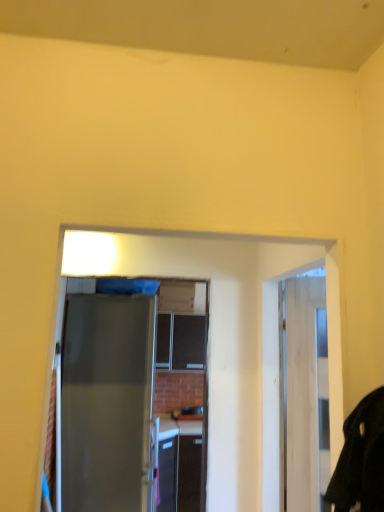
Question: From a real-world perspective, is satin gray door at center positioned under black matte robe at right based on gravity?

Choices:
 (A) no
 (B) yes

Answer: (B)

Question: From the image's perspective, is satin gray door at center on top of black matte robe at right?

Choices:
 (A) no
 (B) yes

Answer: (A)

Question: Can you confirm if satin gray door at center is shorter than black matte robe at right?

Choices:
 (A) yes
 (B) no

Answer: (B)

Question: Does satin gray door at center have a smaller size compared to black matte robe at right?

Choices:
 (A) yes
 (B) no

Answer: (B)

Question: Is satin gray door at center further to camera compared to black matte robe at right?

Choices:
 (A) yes
 (B) no

Answer: (A)

Question: Considering the relative sizes of satin gray door at center and black matte robe at right in the image provided, is satin gray door at center thinner than black matte robe at right?

Choices:
 (A) yes
 (B) no

Answer: (B)

Question: From a real-world perspective, is black matte robe at right located beneath satin gray door at center?

Choices:
 (A) no
 (B) yes

Answer: (A)

Question: Can we say black matte robe at right lies outside satin gray door at center?

Choices:
 (A) yes
 (B) no

Answer: (A)

Question: From the image's perspective, would you say black matte robe at right is positioned over satin gray door at center?

Choices:
 (A) no
 (B) yes

Answer: (B)

Question: Considering the relative sizes of black matte robe at right and satin gray door at center in the image provided, is black matte robe at right bigger than satin gray door at center?

Choices:
 (A) no
 (B) yes

Answer: (A)

Question: From the image's perspective, is black matte robe at right under satin gray door at center?

Choices:
 (A) no
 (B) yes

Answer: (A)

Question: Is black matte robe at right closer to the viewer compared to satin gray door at center?

Choices:
 (A) yes
 (B) no

Answer: (A)

Question: From a real-world perspective, is satin gray door at center physically located above or below black matte robe at right?

Choices:
 (A) above
 (B) below

Answer: (B)